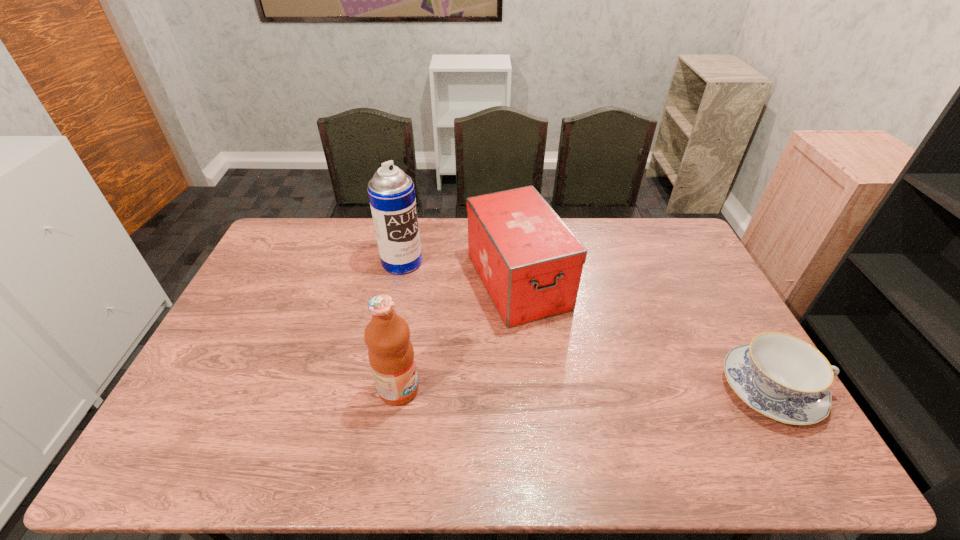
Find the location of a particular element. The height and width of the screenshot is (540, 960). free space on the desktop that is between the second tallest object and the rightmost object and is positioned on the label side of the aerosol can is located at coordinates (589, 389).

This screenshot has width=960, height=540. I want to click on free space on the desktop that is between the second tallest object and the shortest object and is positioned on the handle side of the second shortest object, so click(x=585, y=389).